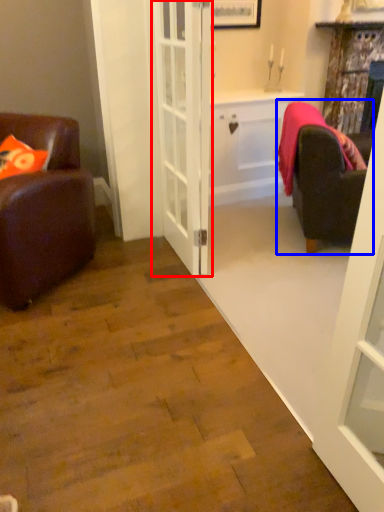
Question: Which object is further to the camera taking this photo, door (highlighted by a red box) or studio couch (highlighted by a blue box)?

Choices:
 (A) door
 (B) studio couch

Answer: (B)